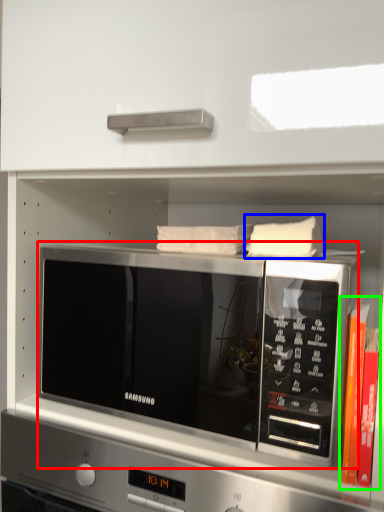
Question: Which object is the farthest from microwave oven (highlighted by a red box)? Choose among these: pillow (highlighted by a blue box) or book (highlighted by a green box).

Choices:
 (A) pillow
 (B) book

Answer: (B)